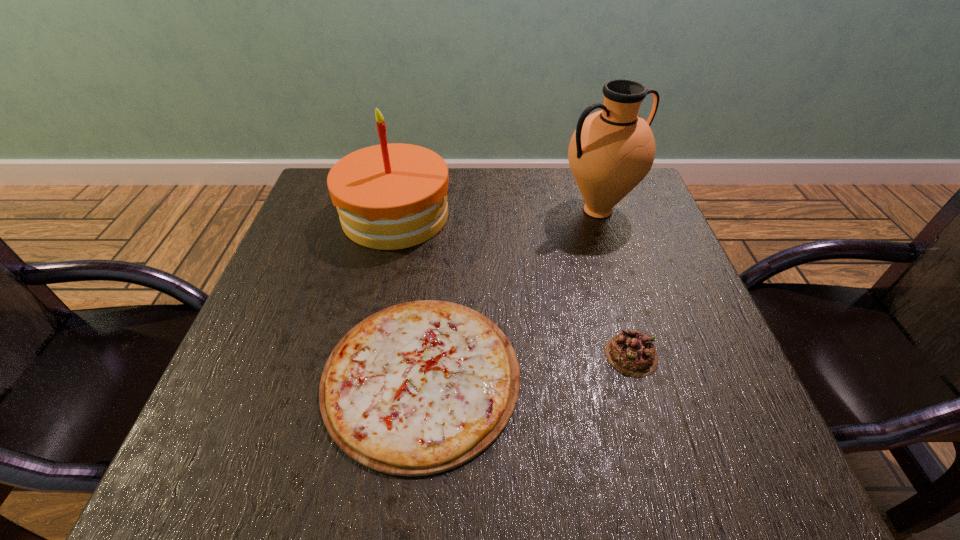
Find the location of a particular element. The height and width of the screenshot is (540, 960). vacant area that lies between the chocolate cake and the birthday cake is located at coordinates (514, 285).

Image resolution: width=960 pixels, height=540 pixels. Identify the location of object that ranks as the closest to the pitcher. (418, 388).

Point out which object is positioned as the third nearest to the third tallest object. Please provide its 2D coordinates. Your answer should be formatted as a tuple, i.e. [(x, y)], where the tuple contains the x and y coordinates of a point satisfying the conditions above.

[(393, 196)]

The height and width of the screenshot is (540, 960). I want to click on free region that satisfies the following two spatial constraints: 1. on the back side of the shortest object; 2. on the right side of the pitcher, so click(x=440, y=211).

Locate an element on the screen. blank area in the image that satisfies the following two spatial constraints: 1. on the back side of the pitcher; 2. on the left side of the birthday cake is located at coordinates (396, 211).

This screenshot has height=540, width=960. What are the coordinates of `vacant point that satisfies the following two spatial constraints: 1. on the back side of the chocolate cake; 2. on the right side of the pitcher` in the screenshot? It's located at (589, 211).

The height and width of the screenshot is (540, 960). Identify the location of free space that satisfies the following two spatial constraints: 1. on the back side of the shortest object; 2. on the left side of the pitcher. (440, 211).